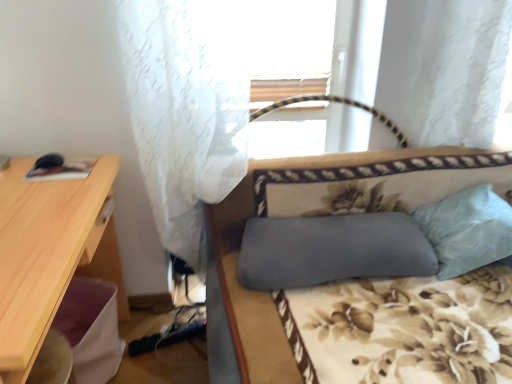
Question: From a real-world perspective, is white sheer curtain at upper left above or below light wood desk at left?

Choices:
 (A) above
 (B) below

Answer: (A)

Question: In the image, is white sheer curtain at upper left positioned in front of or behind light wood desk at left?

Choices:
 (A) behind
 (B) front

Answer: (A)

Question: Which object is the closest to the gray fabric studio couch at center?

Choices:
 (A) light wood desk at left
 (B) white sheer curtain at upper left
 (C) light blue fabric pillow at right, which appears as the first pillow when viewed from the right
 (D) gray fabric pillow at center, which is the 1th pillow from left to right

Answer: (D)

Question: Estimate the real-world distances between objects in this image. Which object is closer to the light wood desk at left?

Choices:
 (A) gray fabric studio couch at center
 (B) gray fabric pillow at center, which appears as the second pillow when viewed from the right
 (C) light blue fabric pillow at right, which appears as the first pillow when viewed from the right
 (D) white sheer curtain at upper left

Answer: (D)